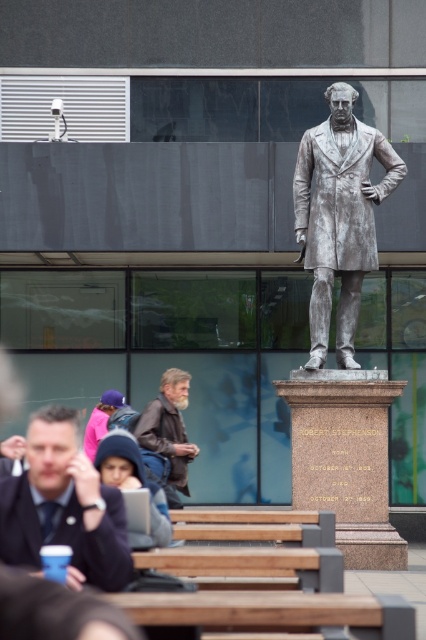
Question: Which point is farther to the camera?

Choices:
 (A) matte black jacket at lower left
 (B) polished silver statue at center
 (C) brown leather jacket at lower center

Answer: (B)

Question: Does matte black jacket at lower left appear over brown leather jacket at lower center?

Choices:
 (A) yes
 (B) no

Answer: (A)

Question: Among these objects, which one is nearest to the camera?

Choices:
 (A) brown leather jacket at lower center
 (B) polished silver statue at center
 (C) matte black jacket at lower left

Answer: (C)

Question: Does matte black jacket at lower left appear over brown leather jacket at lower center?

Choices:
 (A) no
 (B) yes

Answer: (B)

Question: Among these objects, which one is farthest from the camera?

Choices:
 (A) brown leather jacket at lower center
 (B) matte black jacket at lower left
 (C) polished silver statue at center

Answer: (C)

Question: In this image, where is polished silver statue at center located relative to brown leather jacket at lower center?

Choices:
 (A) left
 (B) right

Answer: (B)